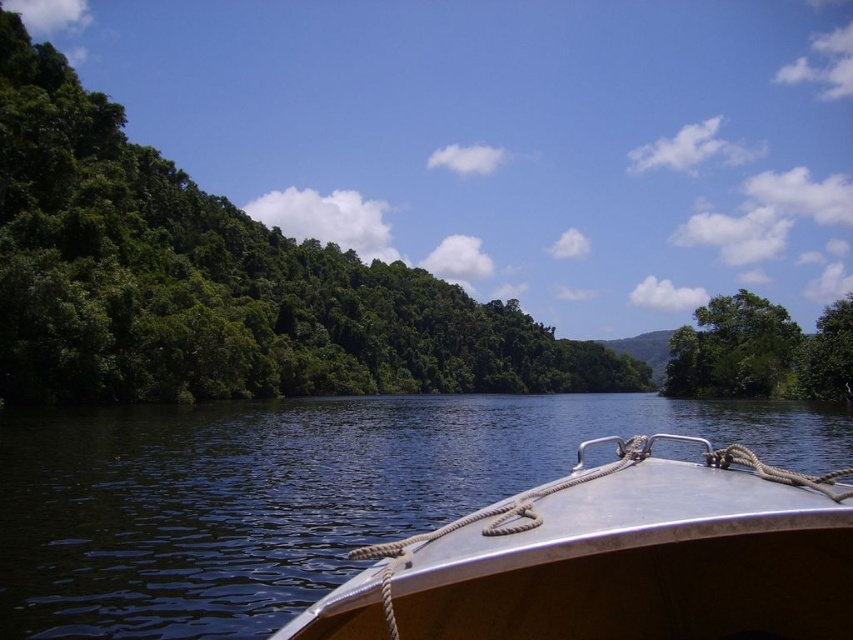
Can you confirm if metallic boat at center is bigger than green leafy tree at right?

Incorrect, metallic boat at center is not larger than green leafy tree at right.

Which of these two, metallic boat at center or green leafy tree at right, stands shorter?

With less height is metallic boat at center.

Does point (677, 474) lie behind point (693, 369)?

No, it is not.

Where is `metallic boat at center`? This screenshot has height=640, width=853. metallic boat at center is located at coordinates (618, 560).

Is green leafy trees at left taller than metallic boat at center?

Yes.

Is green leafy trees at left smaller than metallic boat at center?

Actually, green leafy trees at left might be larger than metallic boat at center.

Does point (119, 177) come closer to viewer compared to point (790, 481)?

No.

You are a GUI agent. You are given a task and a screenshot of the screen. Output one action in this format:
    pyautogui.click(x=<x>, y=<y>)
    Task: Click on the green leafy trees at left
    This screenshot has height=640, width=853.
    Given the screenshot: What is the action you would take?
    pyautogui.click(x=216, y=280)

Does green leafy trees at left have a lesser width compared to green leafy tree at right?

No, green leafy trees at left is not thinner than green leafy tree at right.

This screenshot has width=853, height=640. Describe the element at coordinates (216, 280) in the screenshot. I see `green leafy trees at left` at that location.

Is point (68, 259) behind point (680, 392)?

No, it is in front of (680, 392).

Where is `green leafy trees at left`? This screenshot has height=640, width=853. green leafy trees at left is located at coordinates (216, 280).